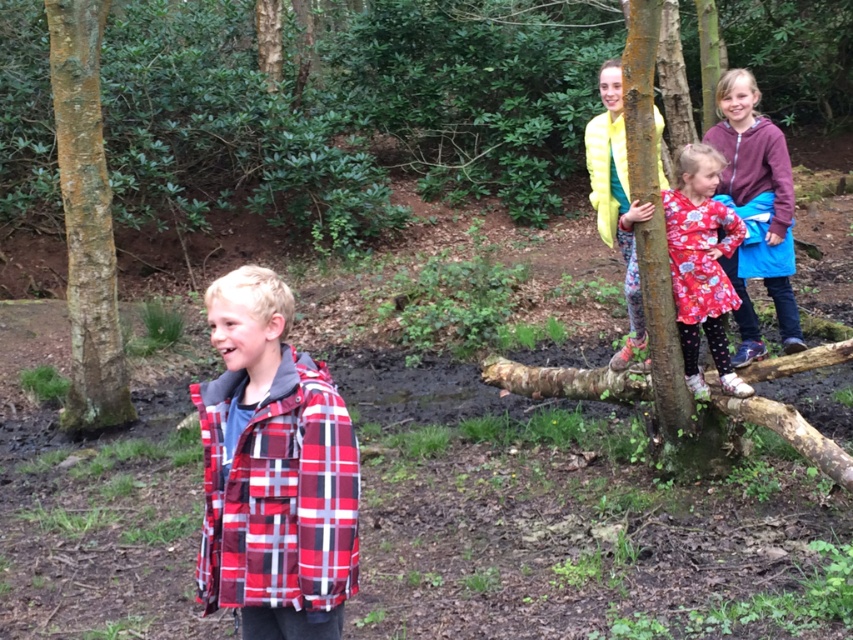
Question: Which of the following is the closest to the observer?

Choices:
 (A) rusty wooden tree trunk at upper right
 (B) floral-patterned fabric dress at upper right

Answer: (A)

Question: Among these points, which one is nearest to the camera?

Choices:
 (A) (305, 486)
 (B) (706, 236)

Answer: (A)

Question: Can you confirm if plaid fabric jacket at lower left is wider than floral dress at upper right?

Choices:
 (A) yes
 (B) no

Answer: (B)

Question: From the image, what is the correct spatial relationship of plaid fabric jacket at lower left in relation to floral dress at upper right?

Choices:
 (A) below
 (B) above

Answer: (A)

Question: Which object is farther from the camera taking this photo?

Choices:
 (A) smooth brown bark at left
 (B) plaid fabric jacket at lower left
 (C) rusty wooden tree trunk at upper right
 (D) floral dress at upper right

Answer: (A)

Question: Can you confirm if plaid fabric jacket at lower left is wider than smooth brown bark at left?

Choices:
 (A) yes
 (B) no

Answer: (B)